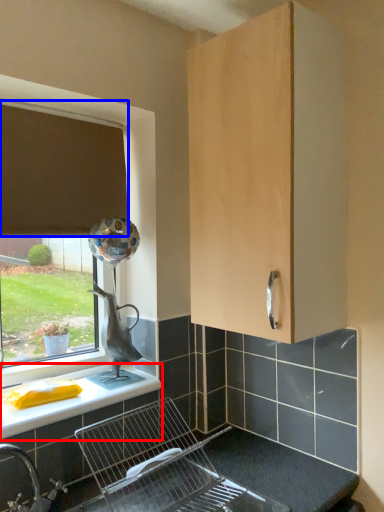
Question: Among these objects, which one is farthest to the camera, countertop (highlighted by a red box) or curtain (highlighted by a blue box)?

Choices:
 (A) countertop
 (B) curtain

Answer: (B)